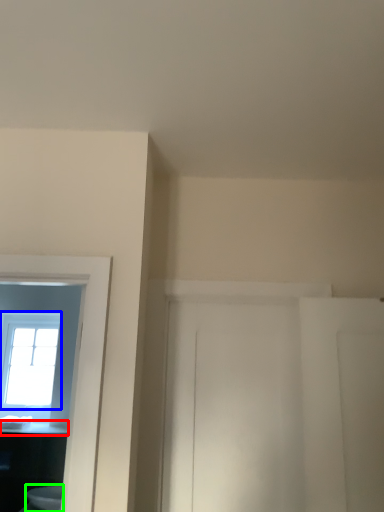
Question: Considering the real-world distances, which object is closest to counter top (highlighted by a red box)? window (highlighted by a blue box) or toilet (highlighted by a green box).

Choices:
 (A) window
 (B) toilet

Answer: (B)